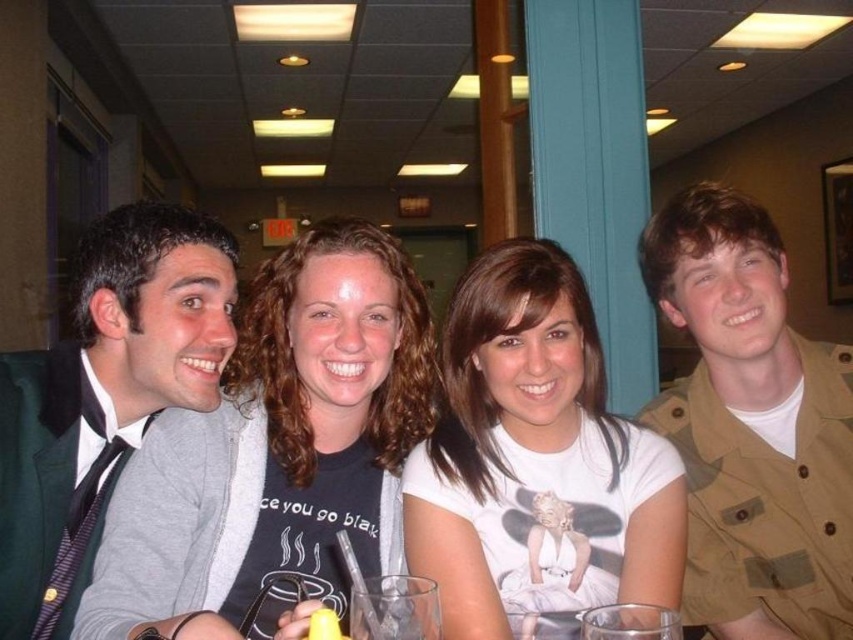
Question: Which point is closer to the camera?

Choices:
 (A) green wool suit at left
 (B) matte black t-shirt at center
 (C) tan fabric shirt at right

Answer: (B)

Question: Which point is closer to the camera?

Choices:
 (A) (511, 515)
 (B) (4, 509)

Answer: (B)

Question: Which of the following is the farthest from the observer?

Choices:
 (A) green wool suit at left
 (B) matte black t-shirt at center

Answer: (A)

Question: Does matte black t-shirt at center have a lesser width compared to white cotton t-shirt at center?

Choices:
 (A) no
 (B) yes

Answer: (A)

Question: Is white cotton t-shirt at center wider than green wool suit at left?

Choices:
 (A) no
 (B) yes

Answer: (B)

Question: Is white cotton t-shirt at center positioned at the back of green wool suit at left?

Choices:
 (A) no
 (B) yes

Answer: (A)